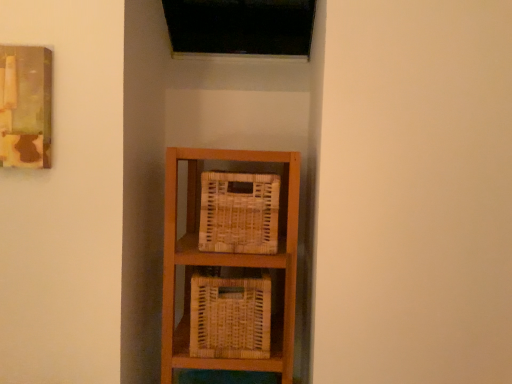
Question: Considering the relative positions of wooden painting at upper left and woven wood basket at center, acting as the second basket starting from the top, in the image provided, is wooden painting at upper left to the left or to the right of woven wood basket at center, acting as the second basket starting from the top,?

Choices:
 (A) left
 (B) right

Answer: (A)

Question: Considering the positions of wooden painting at upper left and woven wood basket at center, acting as the second basket starting from the top, in the image, is wooden painting at upper left taller or shorter than woven wood basket at center, acting as the second basket starting from the top,?

Choices:
 (A) short
 (B) tall

Answer: (B)

Question: Which is nearer to the woven natural basket at center, positioned as the first basket in top-to-bottom order?

Choices:
 (A) wooden painting at upper left
 (B) woven wood basket at center, acting as the second basket starting from the top

Answer: (B)

Question: Estimate the real-world distances between objects in this image. Which object is closer to the wooden painting at upper left?

Choices:
 (A) woven natural basket at center, positioned as the first basket in top-to-bottom order
 (B) woven wood basket at center, arranged as the first basket when ordered from the bottom

Answer: (A)